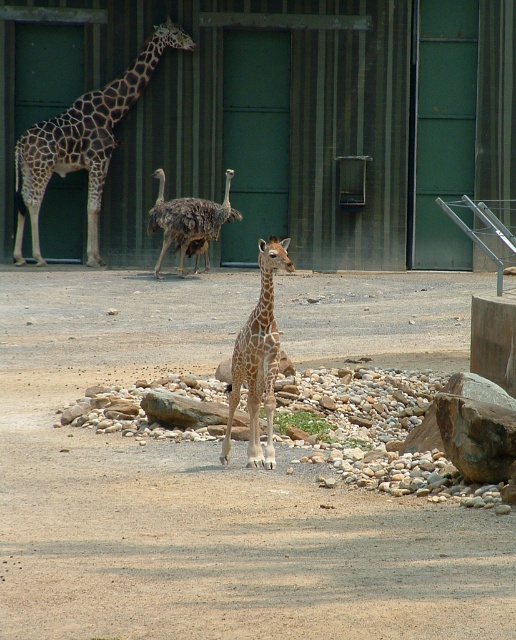
You are a zookeeper observing the enclosure. You need to place a new feeding tray for the ostrich. The tray must be placed on the brown sandy dirt at center. Where should you position the tray relative to the brown feathered ostrich at center?

The brown sandy dirt at center is to the right of the brown feathered ostrich at center, so you should place the feeding tray to the right of the brown feathered ostrich at center on the brown sandy dirt at center.

You are a zookeeper observing the enclosure. You notice the spotted fur giraffe at center and the brown feathered ostrich at center. Which animal is shorter in height?

The spotted fur giraffe at center is shorter in height compared to the brown feathered ostrich at center.